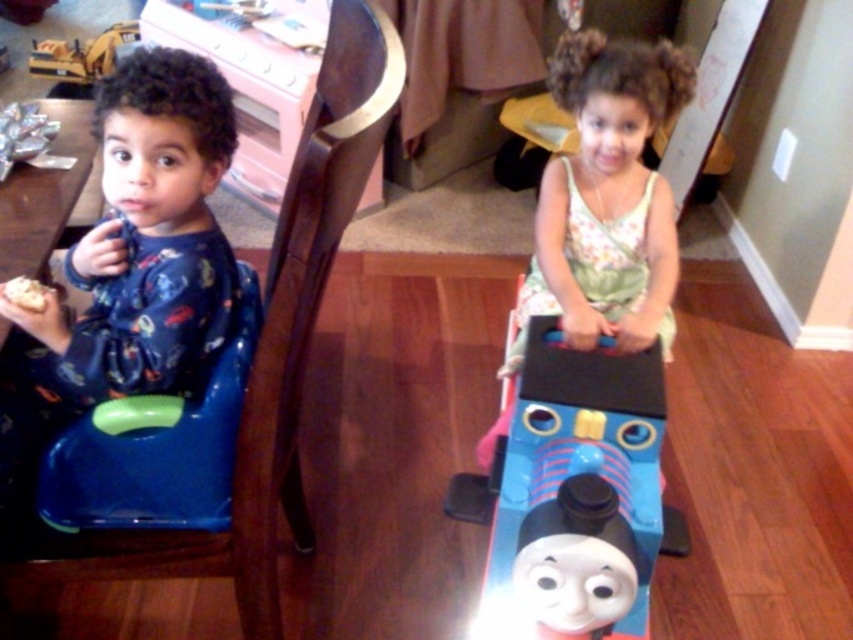
Does floral fabric dress at center have a greater height compared to white crumbly bread at left?

Correct, floral fabric dress at center is much taller as white crumbly bread at left.

Is point (618, 328) behind point (15, 289)?

Yes, it is.

Where is `floral fabric dress at center`? The width and height of the screenshot is (853, 640). floral fabric dress at center is located at coordinates coord(606,198).

Which is more to the right, yellow plastic toy at upper left or white crumbly bread at left?

Positioned to the right is white crumbly bread at left.

Is yellow plastic toy at upper left wider than white crumbly bread at left?

Yes.

Find the location of a particular element. This screenshot has width=853, height=640. yellow plastic toy at upper left is located at coordinates (80, 54).

This screenshot has height=640, width=853. In order to click on yellow plastic toy at upper left in this screenshot , I will do `click(80, 54)`.

Is matte blue pajamas at left wider than white crumbly bread at left?

Yes, matte blue pajamas at left is wider than white crumbly bread at left.

Between point (155, 321) and point (18, 280), which one is positioned in front?

Point (155, 321)

At what (x,y) coordinates should I click in order to perform the action: click on matte blue pajamas at left. Please return your answer as a coordinate pair (x, y). The height and width of the screenshot is (640, 853). Looking at the image, I should click on (131, 262).